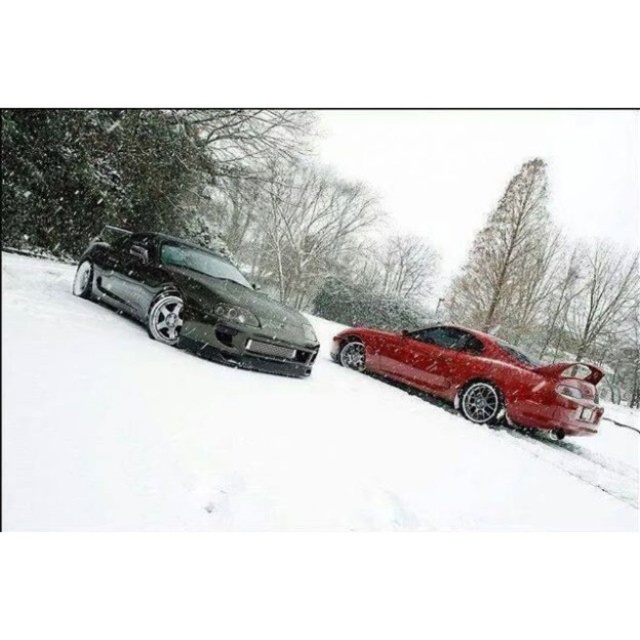
Question: Can you confirm if satin black car at center is positioned to the right of shiny black car at left?

Choices:
 (A) no
 (B) yes

Answer: (B)

Question: Can you confirm if shiny black car at left is smaller than glossy red car at right?

Choices:
 (A) no
 (B) yes

Answer: (A)

Question: Is satin black car at center to the right of glossy red car at right from the viewer's perspective?

Choices:
 (A) no
 (B) yes

Answer: (A)

Question: Estimate the real-world distances between objects in this image. Which object is closer to the shiny black car at left?

Choices:
 (A) glossy red car at right
 (B) satin black car at center

Answer: (B)

Question: Which of these objects is positioned farthest from the satin black car at center?

Choices:
 (A) glossy red car at right
 (B) shiny black car at left

Answer: (A)

Question: Considering the real-world distances, which object is farthest from the satin black car at center?

Choices:
 (A) shiny black car at left
 (B) glossy red car at right

Answer: (B)